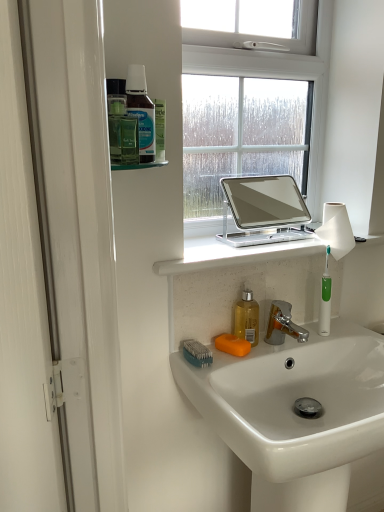
Question: Can you confirm if orange matte soap at sink is positioned to the right of translucent plastic bottle at upper left, the first mouthwash when ordered from left to right?

Choices:
 (A) yes
 (B) no

Answer: (A)

Question: Considering the relative sizes of orange matte soap at sink and translucent plastic bottle at upper left, the 1th mouthwash positioned from the front, in the image provided, is orange matte soap at sink bigger than translucent plastic bottle at upper left, the 1th mouthwash positioned from the front,?

Choices:
 (A) yes
 (B) no

Answer: (B)

Question: From a real-world perspective, is orange matte soap at sink located higher than translucent plastic bottle at upper left, arranged as the second mouthwash when viewed from the right?

Choices:
 (A) yes
 (B) no

Answer: (B)

Question: Is orange matte soap at sink not near translucent plastic bottle at upper left, the first mouthwash when ordered from left to right?

Choices:
 (A) no
 (B) yes

Answer: (A)

Question: Can you confirm if orange matte soap at sink is shorter than translucent plastic bottle at upper left, the first mouthwash viewed from the top?

Choices:
 (A) yes
 (B) no

Answer: (A)

Question: From the image's perspective, is orange matte soap at sink above translucent plastic bottle at upper left, the first mouthwash viewed from the top?

Choices:
 (A) yes
 (B) no

Answer: (B)

Question: Is white stone window sill at center shorter than green plastic toothbrush at lower center?

Choices:
 (A) yes
 (B) no

Answer: (A)

Question: From a real-world perspective, is white stone window sill at center located higher than green plastic toothbrush at lower center?

Choices:
 (A) yes
 (B) no

Answer: (A)

Question: From the image's perspective, is white stone window sill at center located beneath green plastic toothbrush at lower center?

Choices:
 (A) yes
 (B) no

Answer: (B)

Question: Is white stone window sill at center bigger than green plastic toothbrush at lower center?

Choices:
 (A) yes
 (B) no

Answer: (A)

Question: Is white stone window sill at center at the right side of green plastic toothbrush at lower center?

Choices:
 (A) no
 (B) yes

Answer: (B)

Question: Is white stone window sill at center behind green plastic toothbrush at lower center?

Choices:
 (A) no
 (B) yes

Answer: (A)

Question: Is white glossy sink at lower center taller than green plastic toothbrush at right?

Choices:
 (A) no
 (B) yes

Answer: (B)